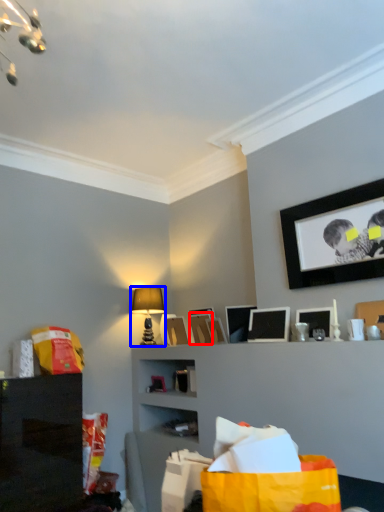
Question: Among these objects, which one is nearest to the camera, picture frame (highlighted by a red box) or table lamp (highlighted by a blue box)?

Choices:
 (A) picture frame
 (B) table lamp

Answer: (A)